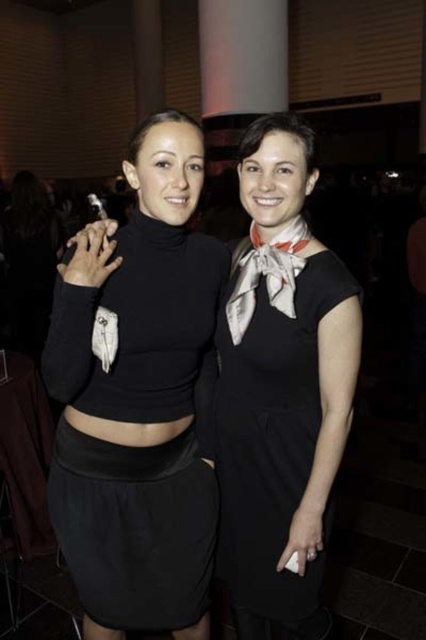
Based on the photo, you are standing in the same room as the people in the image. If you want to reach the black matte turtleneck at center, which direction should you move towards?

The black matte turtleneck at center is located at point 0.622 on the horizontal axis and 0.322 on the vertical axis. Since you are in the same room, you should move towards the direction where the coordinates increase horizontally to 0.622 and vertically to 0.322 to reach it.

You are a photographer at a dimly lit event and see two people at the center wearing the black matte turtleneck at center and the black satin dress at center. Which clothing item is covering the other?

The black matte turtleneck at center is positioned over the black satin dress at center, so the turtleneck is covering the dress.